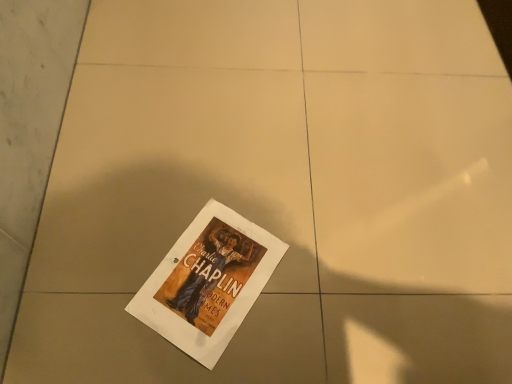
You are a GUI agent. You are given a task and a screenshot of the screen. Output one action in this format:
    pyautogui.click(x=<x>, y=<y>)
    Task: Click on the free spot above white paper poster at center (from a real-world perspective)
    
    Given the screenshot: What is the action you would take?
    pyautogui.click(x=206, y=261)